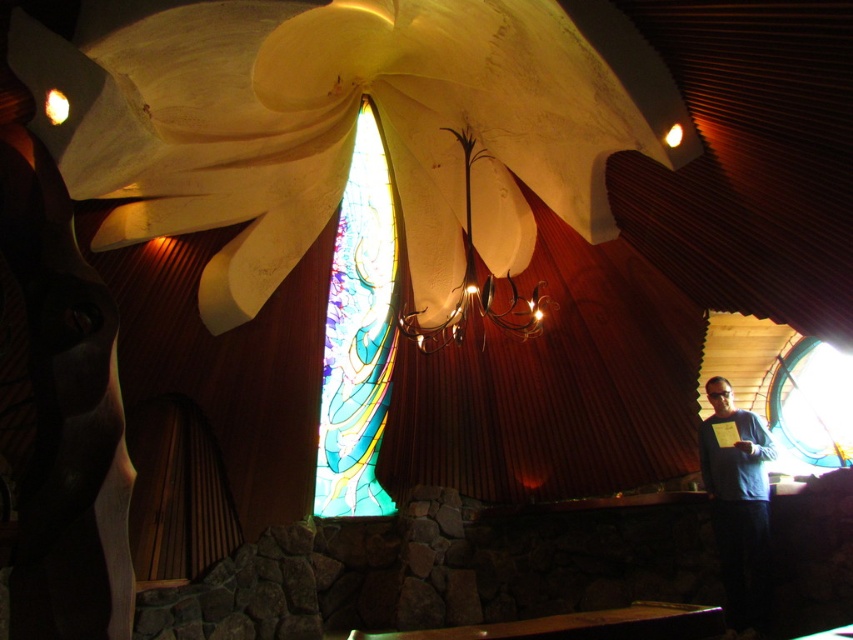
Between point (577, 227) and point (502, 324), which one is positioned behind?

The point (577, 227) is behind.

Is white textured ceiling at center thinner than metallic gold chandelier at upper center?

In fact, white textured ceiling at center might be wider than metallic gold chandelier at upper center.

Is point (642, 68) behind point (537, 285)?

That is False.

Locate an element on the screen. This screenshot has height=640, width=853. white textured ceiling at center is located at coordinates (345, 124).

Between white textured ceiling at center and stained glass window at center, which one is positioned higher?

white textured ceiling at center

Between point (227, 321) and point (368, 289), which one is positioned behind?

The point (368, 289) is more distant.

This screenshot has height=640, width=853. Identify the location of white textured ceiling at center. (345, 124).

Is stained glass window at center to the right of blue sweater at center from the viewer's perspective?

Incorrect, stained glass window at center is not on the right side of blue sweater at center.

Between point (325, 316) and point (756, 570), which one is positioned behind?

The point (325, 316) is more distant.

Image resolution: width=853 pixels, height=640 pixels. Find the location of `stained glass window at center`. stained glass window at center is located at coordinates (358, 336).